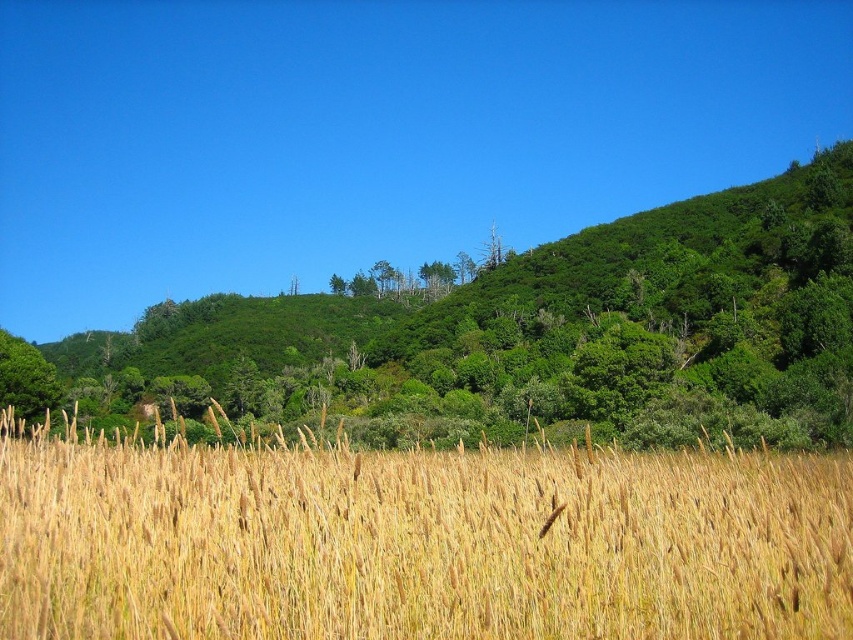
You are a farmer checking the health of your crops. You observe the golden grass at center and the green leafy tree at upper center. Which of these two has a narrower width?

The golden grass at center is thinner than the green leafy tree at upper center, so the golden grass at center has a narrower width.